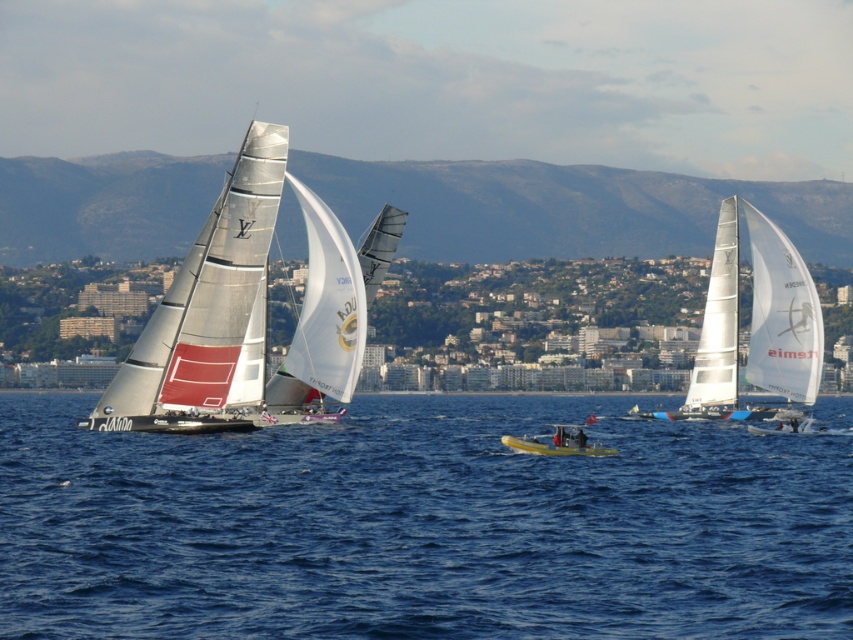
Does white matte sailboat at right have a larger size compared to yellow plastic kayak at center?

Indeed, white matte sailboat at right has a larger size compared to yellow plastic kayak at center.

Who is positioned more to the left, white matte sailboat at right or yellow plastic kayak at center?

From the viewer's perspective, yellow plastic kayak at center appears more on the left side.

Identify the location of white matte sailboat at right. The image size is (853, 640). (753, 323).

The width and height of the screenshot is (853, 640). I want to click on white matte sailboat at right, so click(x=753, y=323).

Does point (386, 513) lie in front of point (561, 438)?

Yes, point (386, 513) is in front of point (561, 438).

Which is in front, point (648, 515) or point (567, 424)?

Point (648, 515) is in front.

Locate an element on the screen. blue water at center is located at coordinates (421, 525).

Does point (236, 353) come in front of point (544, 436)?

Yes, it is.

Which of these two, silver metallic sailboat at left or yellow plastic kayak at center, stands taller?

silver metallic sailboat at left is taller.

The height and width of the screenshot is (640, 853). In order to click on silver metallic sailboat at left in this screenshot , I will do 207,314.

This screenshot has height=640, width=853. Find the location of `silver metallic sailboat at left`. silver metallic sailboat at left is located at coordinates (207, 314).